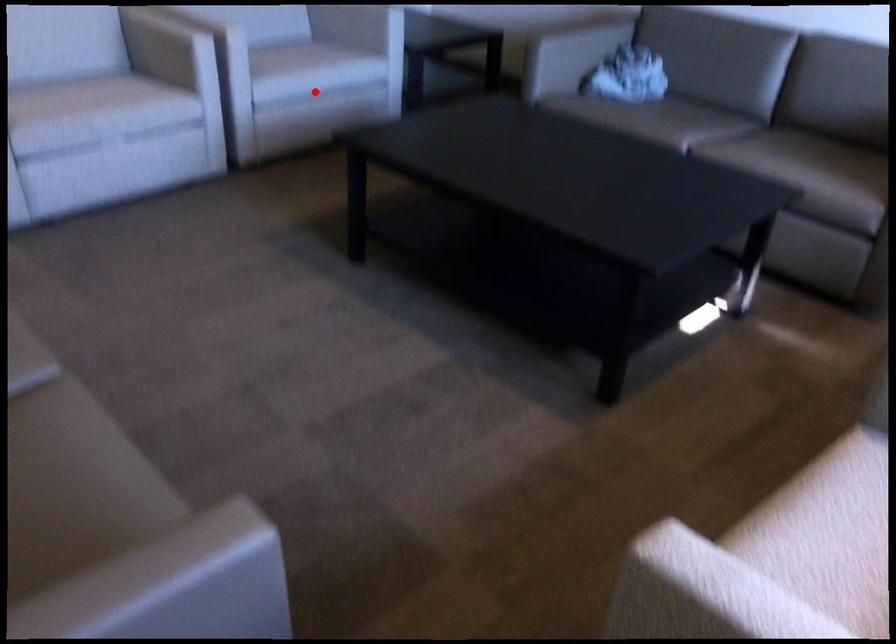
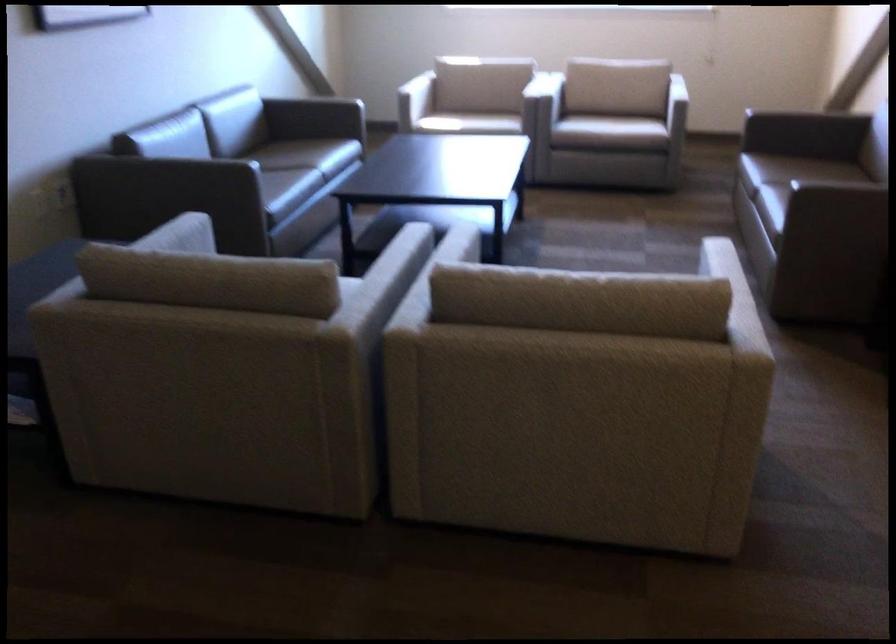
Question: I am providing you with two images of the same scene from different viewpoints. A red point is marked on the first image. At the location where the point appears in image 1, is it still visible in image 2?

Choices:
 (A) Yes
 (B) No

Answer: (B)